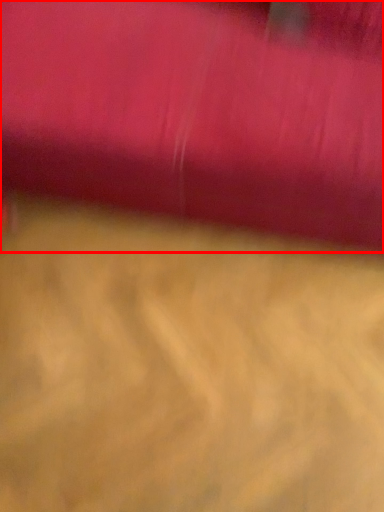
Question: From the image, what is the correct spatial relationship of curtain (annotated by the red box) in relation to surface?

Choices:
 (A) right
 (B) left

Answer: (A)